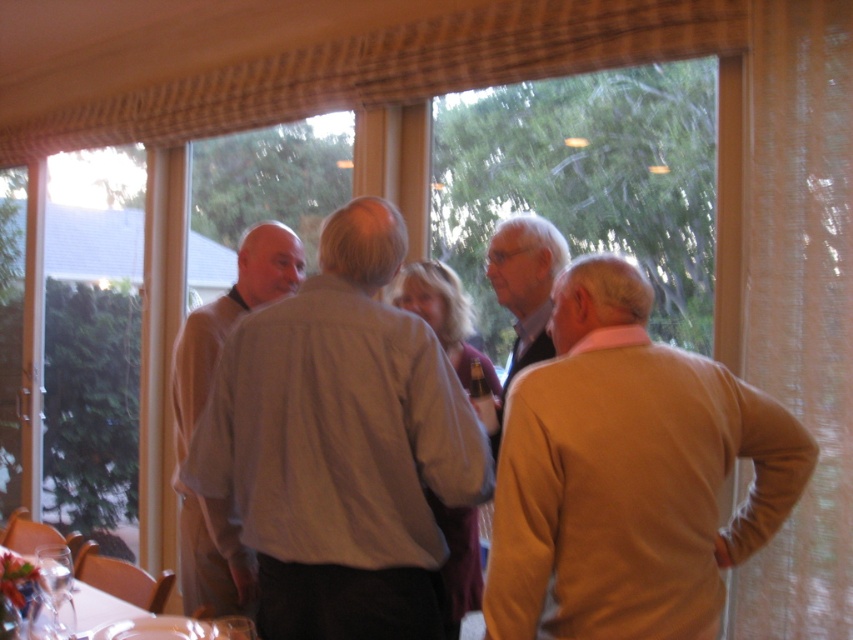
Question: Among these objects, which one is farthest from the camera?

Choices:
 (A) transparent glass window at center
 (B) light brown sweater at right

Answer: (A)

Question: Which point appears closest to the camera in this image?

Choices:
 (A) (294, 611)
 (B) (476, 196)
 (C) (207, 312)

Answer: (A)

Question: Can you confirm if light beige shirt at center is wider than clear glassware at lower left?

Choices:
 (A) yes
 (B) no

Answer: (B)

Question: Does light brown sweater at right appear on the left side of light beige shirt at center?

Choices:
 (A) no
 (B) yes

Answer: (A)

Question: In this image, where is light gray shirt at center located relative to light brown sweater at right?

Choices:
 (A) above
 (B) below

Answer: (A)

Question: Which of the following is the farthest from the observer?

Choices:
 (A) light beige shirt at center
 (B) light brown sweater at right
 (C) transparent glass window at center
 (D) clear glassware at lower left

Answer: (C)